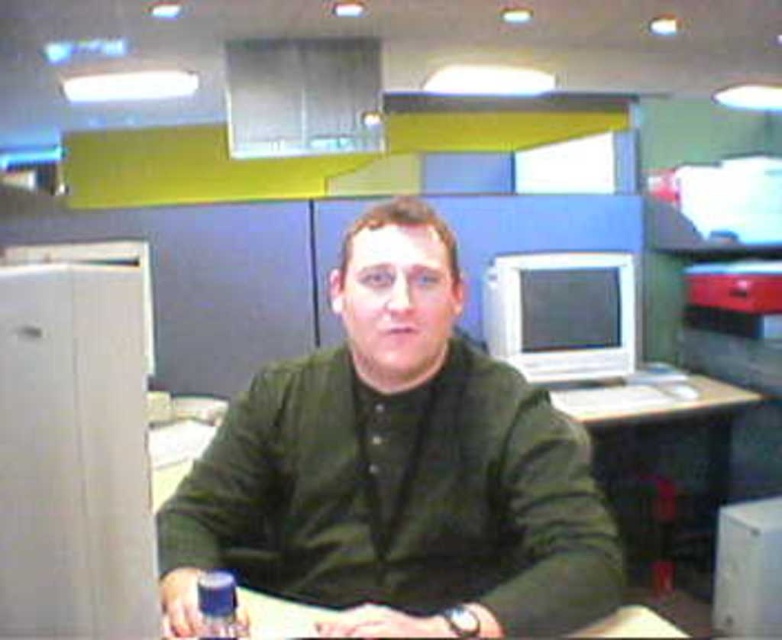
Question: Is dark green shirt at center to the left of blue plastic bottle at lower center from the viewer's perspective?

Choices:
 (A) no
 (B) yes

Answer: (A)

Question: Is dark green shirt at center positioned behind blue plastic bottle at lower center?

Choices:
 (A) yes
 (B) no

Answer: (A)

Question: Among these objects, which one is nearest to the camera?

Choices:
 (A) blue plastic bottle at lower center
 (B) dark green shirt at center

Answer: (A)

Question: Among these objects, which one is nearest to the camera?

Choices:
 (A) dark green shirt at center
 (B) blue plastic bottle at lower center

Answer: (B)

Question: Can you confirm if dark green shirt at center is wider than blue plastic bottle at lower center?

Choices:
 (A) no
 (B) yes

Answer: (B)

Question: Which point appears farthest from the camera in this image?

Choices:
 (A) (411, 557)
 (B) (203, 600)

Answer: (A)